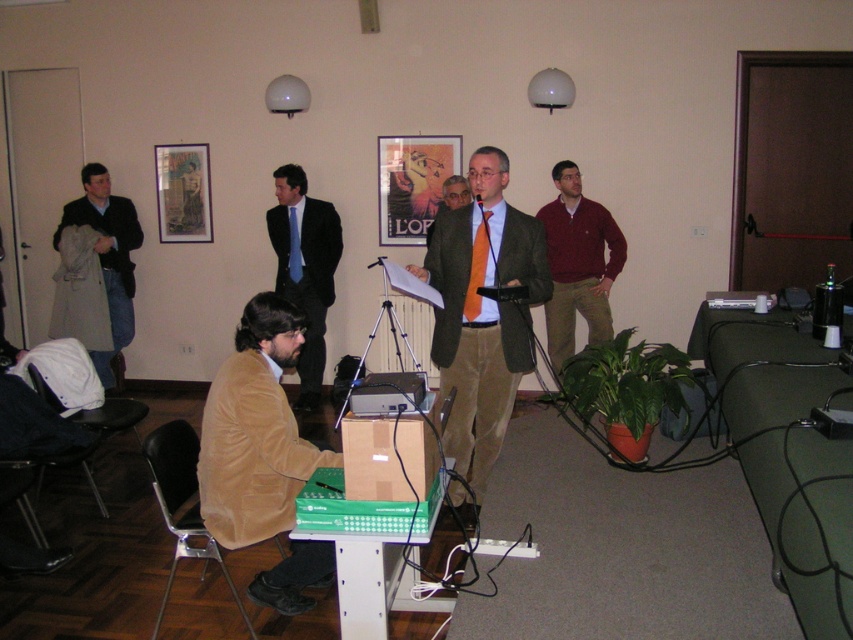
Does dark blue denim jeans at left appear on the right side of matte brown suit at center?

Incorrect, dark blue denim jeans at left is not on the right side of matte brown suit at center.

In order to click on dark blue denim jeans at left in this screenshot , I will do `click(108, 256)`.

Is point (103, 234) positioned after point (451, 202)?

Yes, point (103, 234) is behind point (451, 202).

I want to click on dark blue denim jeans at left, so tap(108, 256).

Can you confirm if matte green suit at center is wider than suede jacket at lower left?

Correct, the width of matte green suit at center exceeds that of suede jacket at lower left.

Which is in front, point (498, 412) or point (287, 426)?

Point (287, 426) is in front.

At what (x,y) coordinates should I click in order to perform the action: click on matte green suit at center. Please return your answer as a coordinate pair (x, y). Looking at the image, I should click on (482, 317).

Is the position of suede jacket at lower left less distant than that of brown cardboard box at center?

No, it is not.

Is point (268, 365) positioned before point (341, 436)?

That is True.

Does point (302, 600) lie behind point (345, 419)?

Yes, it is behind point (345, 419).

I want to click on suede jacket at lower left, so click(x=254, y=429).